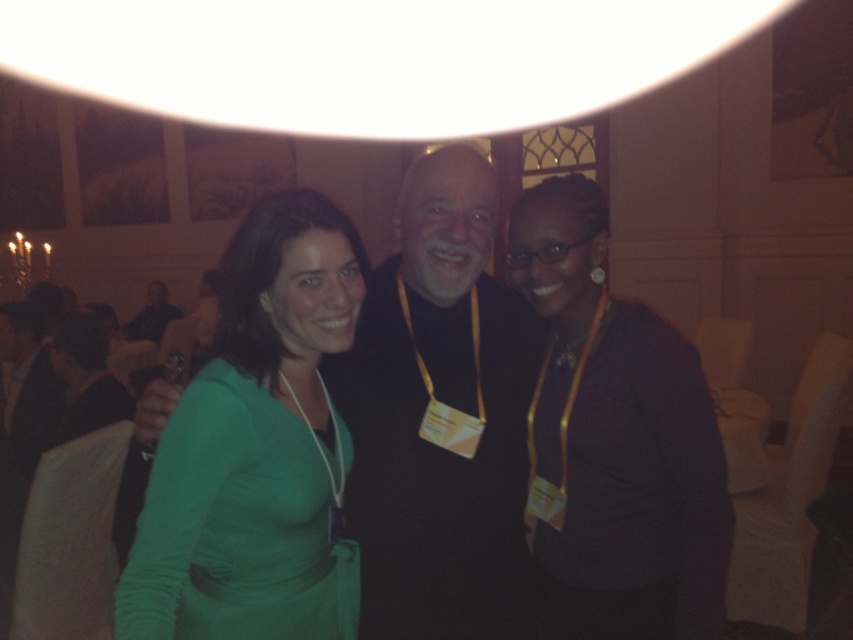
What are the coordinates of `green fabric dress at center` in the screenshot? It's located at (450, 404).

Does point (469, 240) come farther from viewer compared to point (611, 556)?

No.

Identify the location of green fabric dress at center. (450, 404).

Does black matte jacket at center have a lesser height compared to dark brown leather jacket at left?

No.

Which is behind, point (392, 636) or point (137, 328)?

Positioned behind is point (137, 328).

Describe the element at coordinates (440, 419) in the screenshot. The height and width of the screenshot is (640, 853). I see `black matte jacket at center` at that location.

The width and height of the screenshot is (853, 640). I want to click on black matte jacket at center, so coord(440,419).

Can you confirm if green matte dress at center is positioned above dark brown leather jacket at left?

No.

Find the location of a particular element. This screenshot has height=640, width=853. green matte dress at center is located at coordinates (256, 449).

Between point (193, 476) and point (131, 326), which one is positioned in front?

Point (193, 476)

At what (x,y) coordinates should I click in order to perform the action: click on green matte dress at center. Please return your answer as a coordinate pair (x, y). Looking at the image, I should click on (256, 449).